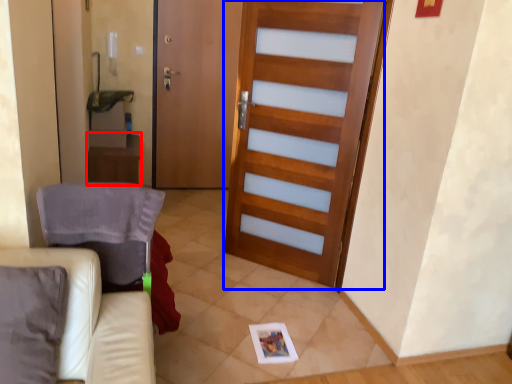
Question: Which object appears closest to the camera in this image, table (highlighted by a red box) or barn door (highlighted by a blue box)?

Choices:
 (A) table
 (B) barn door

Answer: (B)